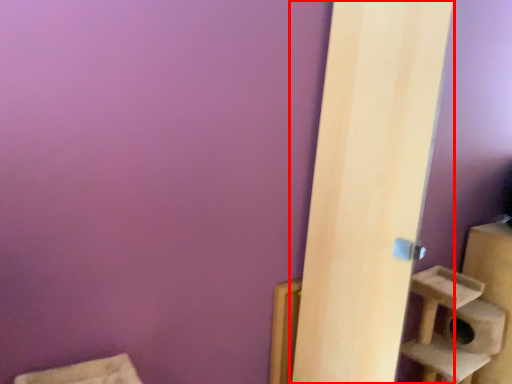
Question: From the image, what is the correct spatial relationship of door (annotated by the red box) in relation to window sill?

Choices:
 (A) left
 (B) right

Answer: (B)